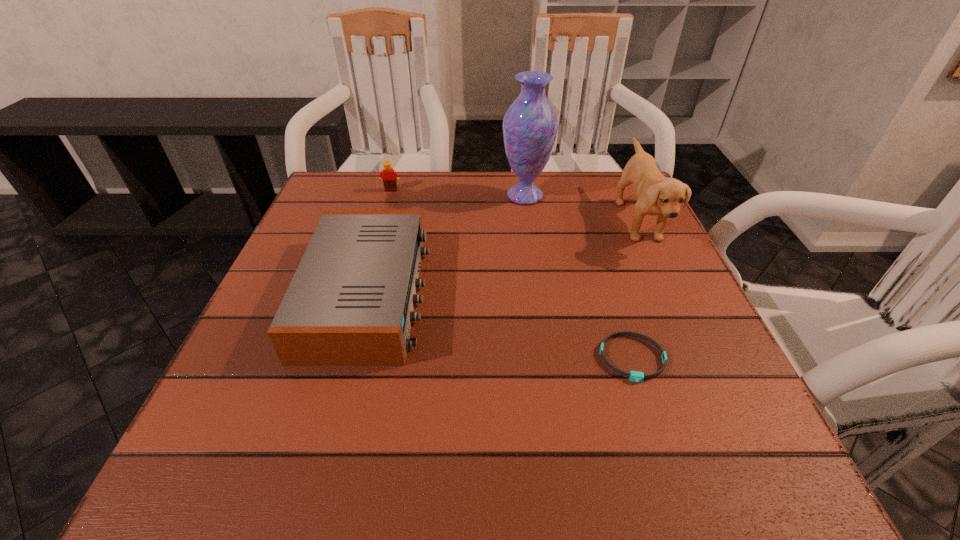
Locate an element on the screen. unoccupied position between the wristband and the radio receiver is located at coordinates (500, 327).

At what (x,y) coordinates should I click in order to perform the action: click on vacant area that lies between the shortest object and the Lego. Please return your answer as a coordinate pair (x, y). Looking at the image, I should click on (512, 274).

Image resolution: width=960 pixels, height=540 pixels. Find the location of `free space between the second tallest object and the third object from left to right`. free space between the second tallest object and the third object from left to right is located at coordinates (582, 208).

I want to click on free spot between the Lego and the second tallest object, so click(515, 206).

At what (x,y) coordinates should I click in order to perform the action: click on empty space that is in between the tallest object and the shortest object. Please return your answer as a coordinate pair (x, y). Looking at the image, I should click on (579, 277).

Locate an element on the screen. This screenshot has height=540, width=960. free space that is in between the tallest object and the Lego is located at coordinates click(458, 193).

Locate an element on the screen. The width and height of the screenshot is (960, 540). object identified as the fourth closest to the Lego is located at coordinates (635, 376).

Choose which object is the nearest neighbor to the wristband. Please provide its 2D coordinates. Your answer should be formatted as a tuple, i.e. [(x, y)], where the tuple contains the x and y coordinates of a point satisfying the conditions above.

[(656, 194)]

The image size is (960, 540). What are the coordinates of `vacant space that satisfies the following two spatial constraints: 1. on the front side of the tallest object; 2. on the front panel of the radio receiver` in the screenshot? It's located at (539, 295).

Find the location of `free region that satisfies the following two spatial constraints: 1. on the face of the Lego; 2. on the left side of the third object from right to left`. free region that satisfies the following two spatial constraints: 1. on the face of the Lego; 2. on the left side of the third object from right to left is located at coordinates (389, 196).